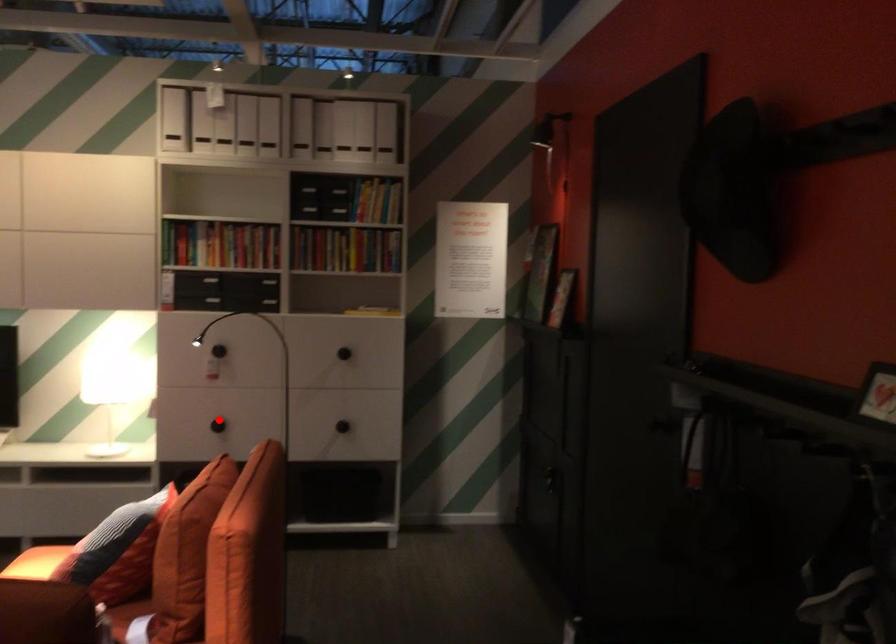
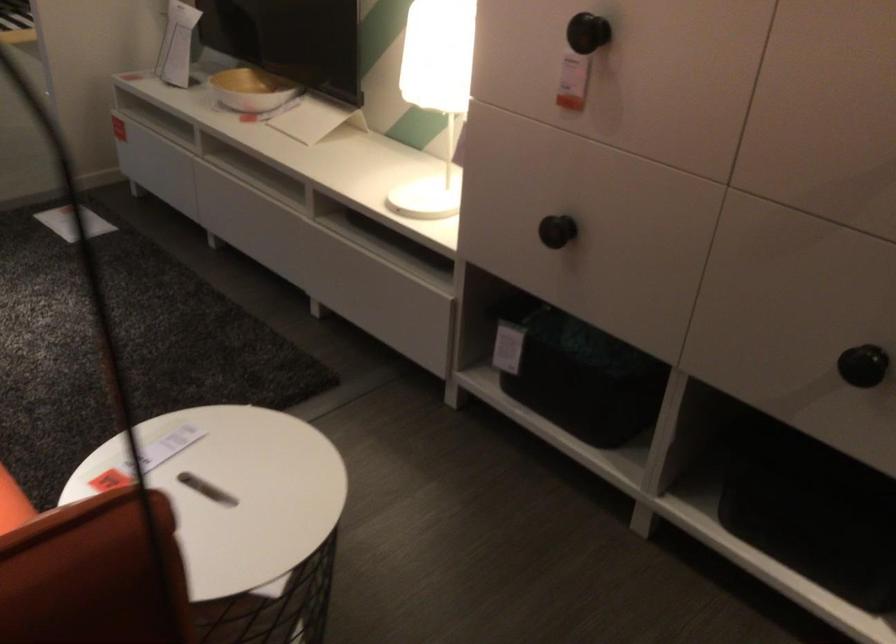
In the second image, find the point that corresponds to the highlighted location in the first image.

(556, 231)